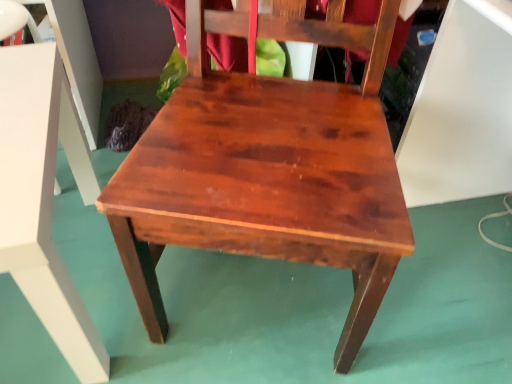
Question: From a real-world perspective, is satin wood chair at center above or below wooden table at center?

Choices:
 (A) below
 (B) above

Answer: (B)

Question: Is satin wood chair at center situated inside wooden table at center or outside?

Choices:
 (A) inside
 (B) outside

Answer: (B)

Question: Does point (374, 190) appear closer or farther from the camera than point (96, 357)?

Choices:
 (A) farther
 (B) closer

Answer: (B)

Question: Is wooden table at center wider or thinner than satin wood chair at center?

Choices:
 (A) wide
 (B) thin

Answer: (B)

Question: Is point (41, 304) positioned closer to the camera than point (131, 162)?

Choices:
 (A) farther
 (B) closer

Answer: (B)

Question: Considering the positions of wooden table at center and satin wood chair at center in the image, is wooden table at center taller or shorter than satin wood chair at center?

Choices:
 (A) tall
 (B) short

Answer: (B)

Question: From the image's perspective, is wooden table at center above or below satin wood chair at center?

Choices:
 (A) below
 (B) above

Answer: (A)